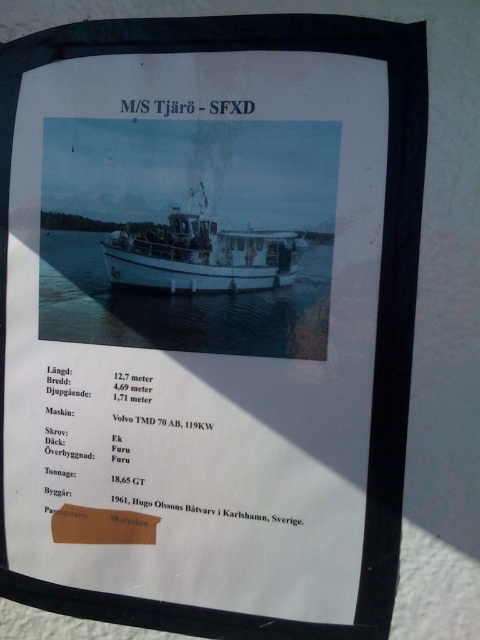
You are looking at the poster of the M S Tj r SFXD. You see the clear blue water at center and the white matte boat at center. Which object is positioned closer to you?

The clear blue water at center is closer to the viewer than the white matte boat at center.

Based on the poster, which point, point (240, 342) or point (115, 250), is closer to the bow of the M S Tj r? Please answer according to the spatial relationship between the two points in the image.

Point (240, 342) is in front of point (115, 250), so it is closer to the bow of the M S Tj r.

Consider the image. You are designing a scale model of the M.S. Tj?r? where the clear blue water at center and white matte boat at center must be accurately represented. If the actual distance between them is 3.14 meters, what scale would you use for the model to maintain the same proportion?

The scale would be 1 cm to 1 meter because the model distance between clear blue water at center and white matte boat at center is 3.14 centimeters, and the actual distance is 3.14 meters, so 3.14 cm represents 3.14 meters, which simplifies to 1 cm to 1 meter.